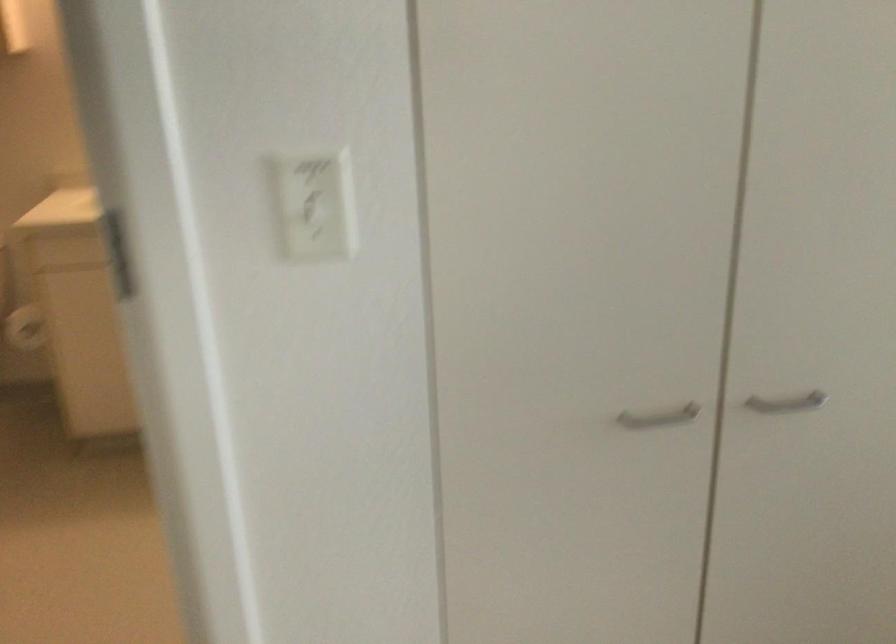
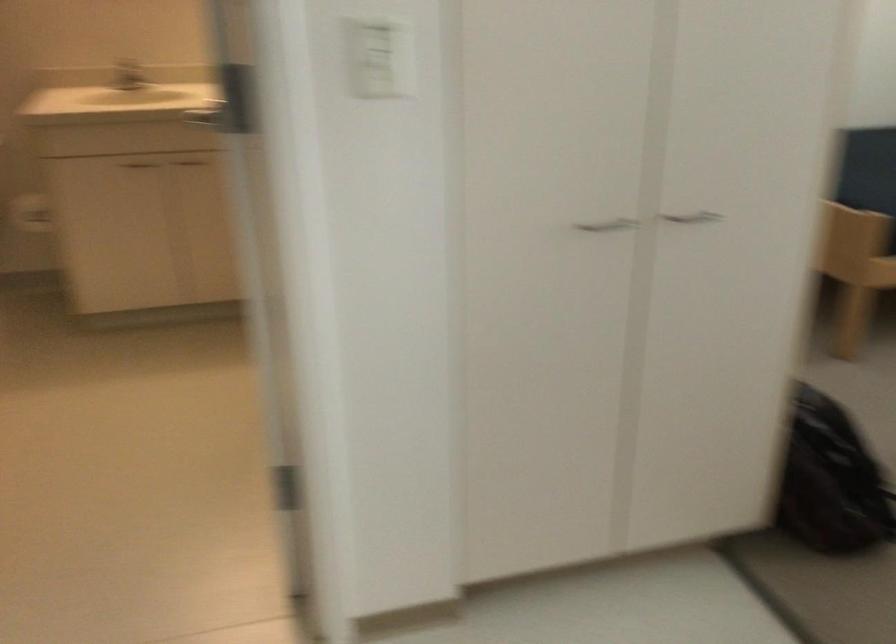
The point at (322, 203) is marked in the first image. Where is the corresponding point in the second image?

(381, 59)